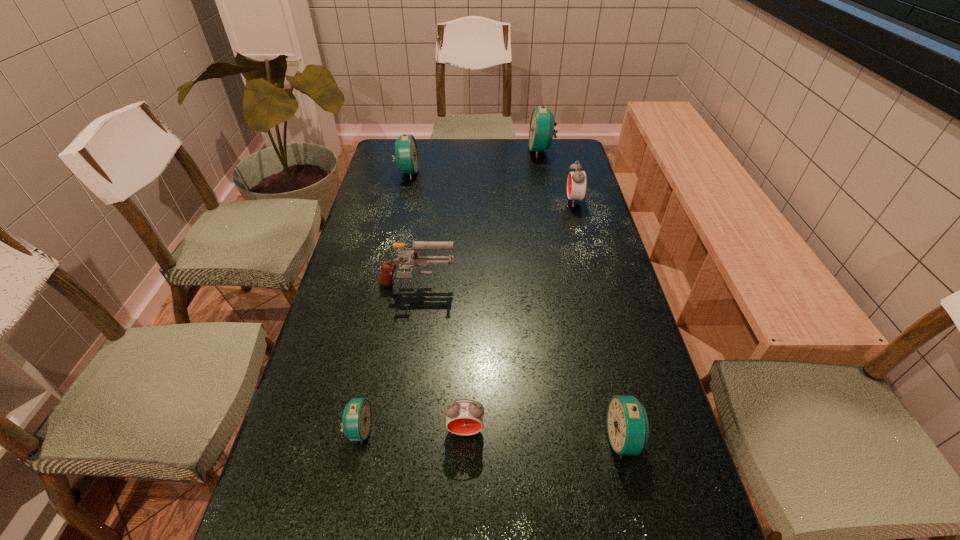
Locate an element on the screen. free space at the right edge is located at coordinates (550, 188).

Identify the location of empty space that is in between the fourth nearest object and the second smallest blue alarm clock. This screenshot has height=540, width=960. (520, 363).

Find the location of a particular element. The width and height of the screenshot is (960, 540). free space between the shortest object and the right red alarm clock is located at coordinates (467, 316).

Image resolution: width=960 pixels, height=540 pixels. I want to click on unoccupied position between the second farthest object and the second smallest blue alarm clock, so click(x=516, y=306).

Find the location of `vacant area between the farthest blue alarm clock and the nearer red alarm clock`. vacant area between the farthest blue alarm clock and the nearer red alarm clock is located at coordinates (503, 290).

At what (x,y) coordinates should I click in order to perform the action: click on vacant point located between the left red alarm clock and the farthest blue alarm clock. Please return your answer as a coordinate pair (x, y). This screenshot has height=540, width=960. Looking at the image, I should click on (503, 290).

Where is `free space between the third nearest blue alarm clock and the left red alarm clock`? The height and width of the screenshot is (540, 960). free space between the third nearest blue alarm clock and the left red alarm clock is located at coordinates (436, 301).

Where is `free space between the smallest blue alarm clock and the bigger red alarm clock`? The height and width of the screenshot is (540, 960). free space between the smallest blue alarm clock and the bigger red alarm clock is located at coordinates (467, 316).

Where is `vacant space in between the fifth nearest object and the farthest alarm clock`? This screenshot has width=960, height=540. vacant space in between the fifth nearest object and the farthest alarm clock is located at coordinates (558, 176).

Locate which object ranks fifth in proximity to the third biggest blue alarm clock. Please provide its 2D coordinates. Your answer should be formatted as a tuple, i.e. [(x, y)], where the tuple contains the x and y coordinates of a point satisfying the conditions above.

[(406, 155)]